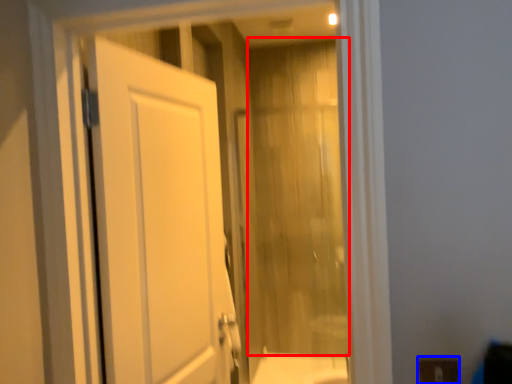
Question: Which object is closer to the camera taking this photo, curtain (highlighted by a red box) or electric outlet (highlighted by a blue box)?

Choices:
 (A) curtain
 (B) electric outlet

Answer: (B)